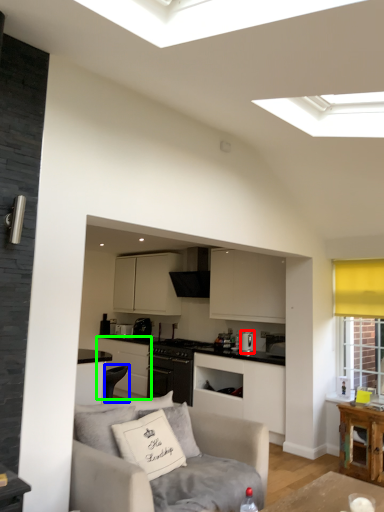
Question: Considering the real-world distances, which object is farthest from appliance (highlighted by a red box)? armchair (highlighted by a blue box) or cabinetry (highlighted by a green box)?

Choices:
 (A) armchair
 (B) cabinetry

Answer: (A)